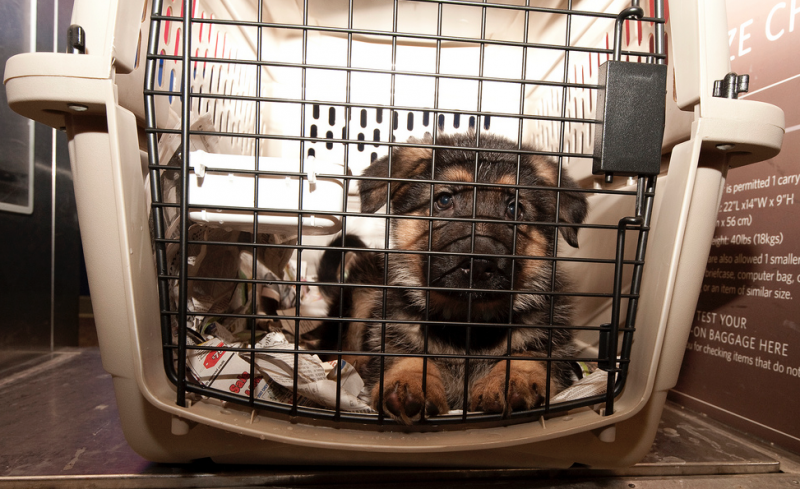
The height and width of the screenshot is (489, 800). What are the coordinates of `box` in the screenshot? It's located at (224, 364).